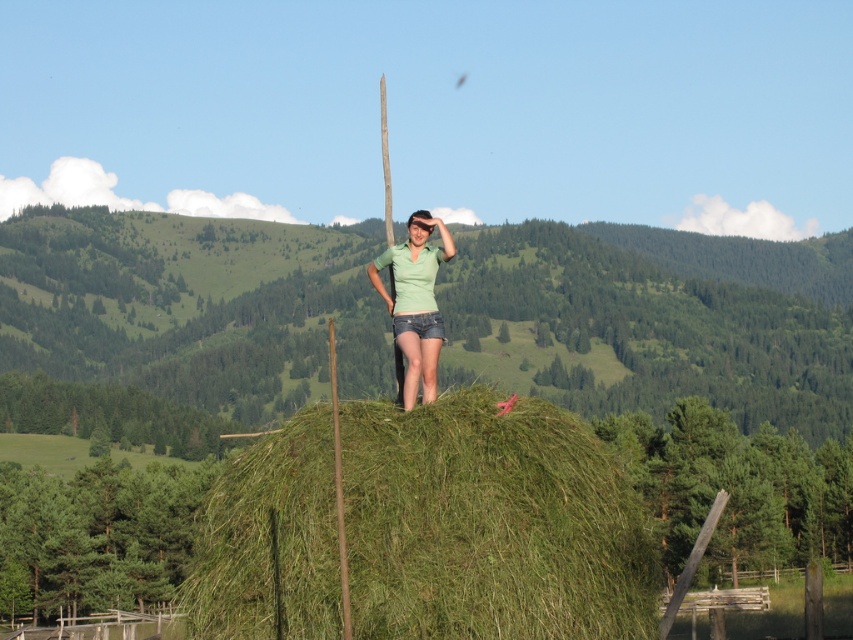
Describe the element at coordinates (490, 524) in the screenshot. The width and height of the screenshot is (853, 640). I see `green grassy hay at center` at that location.

Is point (428, 474) positioned in front of point (416, 358)?

That is True.

Image resolution: width=853 pixels, height=640 pixels. What are the coordinates of `green grassy hay at center` in the screenshot? It's located at (490, 524).